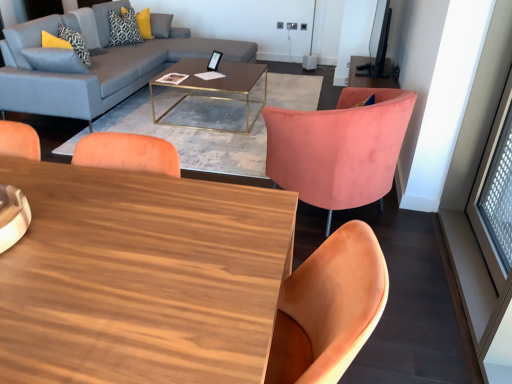
Question: Does point (229, 77) appear closer or farther from the camera than point (137, 36)?

Choices:
 (A) closer
 (B) farther

Answer: (A)

Question: Is metallic gold coffee table at center, positioned as the 1th coffee table in top-to-bottom order, wider or thinner than yellow textured pillow at upper left, the second pillow viewed from the front?

Choices:
 (A) wide
 (B) thin

Answer: (A)

Question: Estimate the real-world distances between objects in this image. Which object is farther from the metallic gold coffee table at center, the 2th coffee table ordered from the bottom?

Choices:
 (A) matte gray fabric couch at upper left
 (B) patterned fabric pillow at upper left, the 1th pillow ordered from the bottom
 (C) yellow textured pillow at upper left, marked as the 1th pillow in a top-to-bottom arrangement
 (D) velvet pink chair at center
 (E) wooden coffee table at center, which is counted as the second coffee table, starting from the back

Answer: (E)

Question: Considering the real-world distances, which object is farthest from the matte gray fabric couch at upper left?

Choices:
 (A) yellow textured pillow at upper left, marked as the 1th pillow in a top-to-bottom arrangement
 (B) velvet pink chair at center
 (C) metallic gold coffee table at center, the 2th coffee table ordered from the bottom
 (D) patterned fabric pillow at upper left, acting as the first pillow starting from the front
 (E) wooden coffee table at center, the first coffee table ordered from the bottom

Answer: (E)